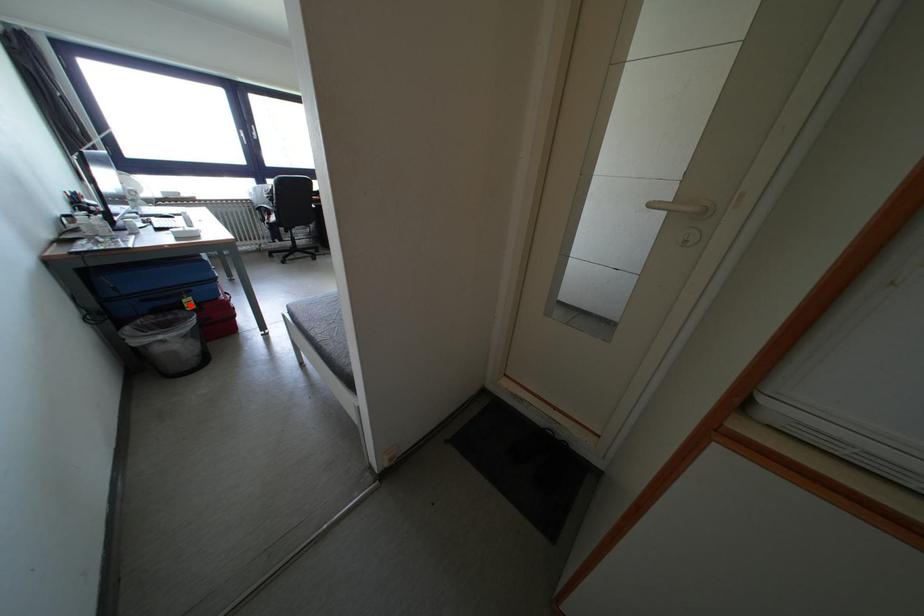
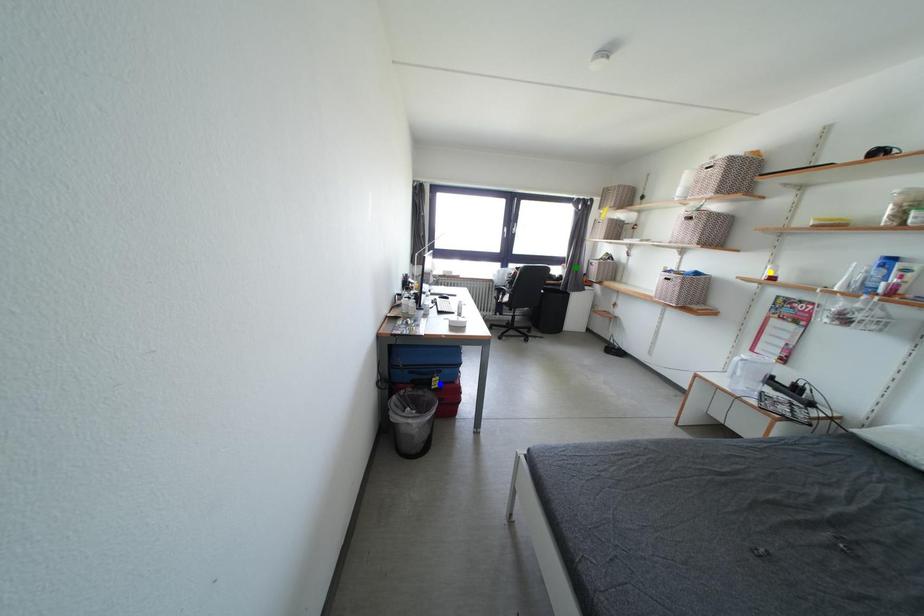
Question: I am providing you with two images of the same scene from different viewpoints. A red point is marked on the first image. You are given multiple points on the second image. Which spot in image 2 lines up with the point in image 1?

Choices:
 (A) blue point
 (B) yellow point
 (C) green point

Answer: (A)